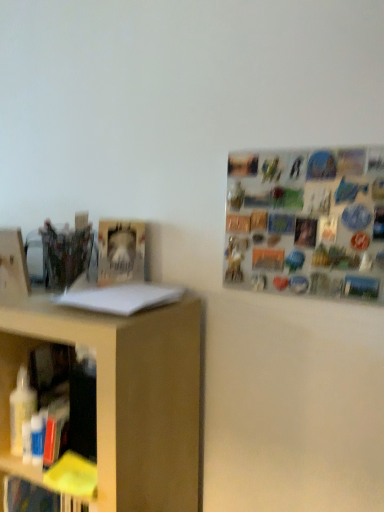
Where is `free space above white paper at left, arranged as the 1th book when viewed from the front (from a real-world perspective)`? free space above white paper at left, arranged as the 1th book when viewed from the front (from a real-world perspective) is located at coordinates (121, 289).